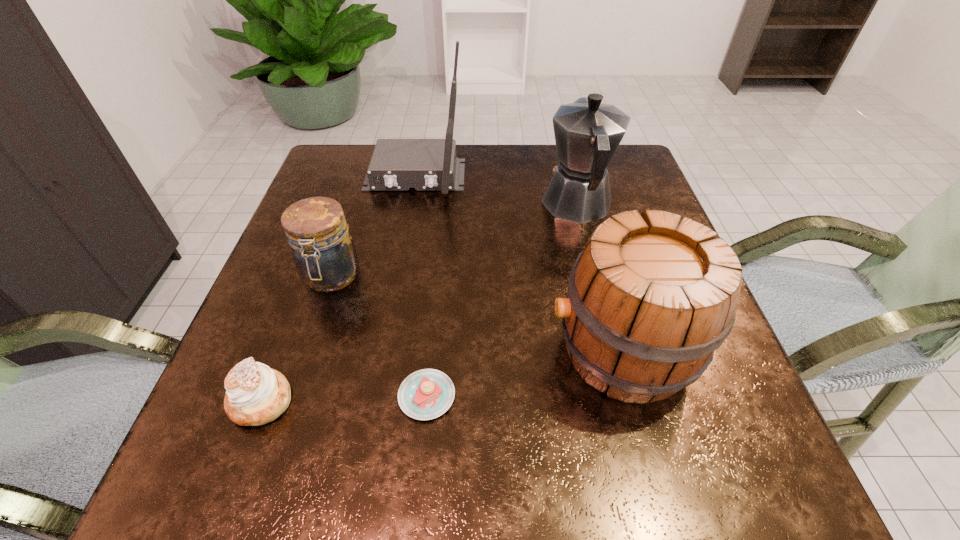
Image resolution: width=960 pixels, height=540 pixels. I want to click on free space located 0.170m at the spout of the coffeepot, so click(x=562, y=144).

Where is `free region located at the spout of the coffeepot`? free region located at the spout of the coffeepot is located at coordinates (563, 147).

At what (x,y) coordinates should I click in order to perform the action: click on vacant space located 0.340m on the side of the cider where the spigot is located. Please return your answer as a coordinate pair (x, y). Looking at the image, I should click on (352, 352).

Identify the location of vacant space positioned 0.380m on the side of the cider where the spigot is located. The width and height of the screenshot is (960, 540). (329, 352).

Image resolution: width=960 pixels, height=540 pixels. In order to click on free space located 0.060m on the side of the cider where the spigot is located in this screenshot , I will do `click(514, 352)`.

The image size is (960, 540). I want to click on free space located on the lid of the jar, so click(x=301, y=369).

This screenshot has height=540, width=960. I want to click on vacant region located 0.120m on the back of the second shortest object, so click(x=293, y=318).

Where is `free space located 0.280m on the left of the shorter pastry`? free space located 0.280m on the left of the shorter pastry is located at coordinates (224, 396).

Identify the location of router present at the far edge. The height and width of the screenshot is (540, 960). (397, 164).

The width and height of the screenshot is (960, 540). What are the coordinates of `coffeepot positioned at the far edge` in the screenshot? It's located at (587, 132).